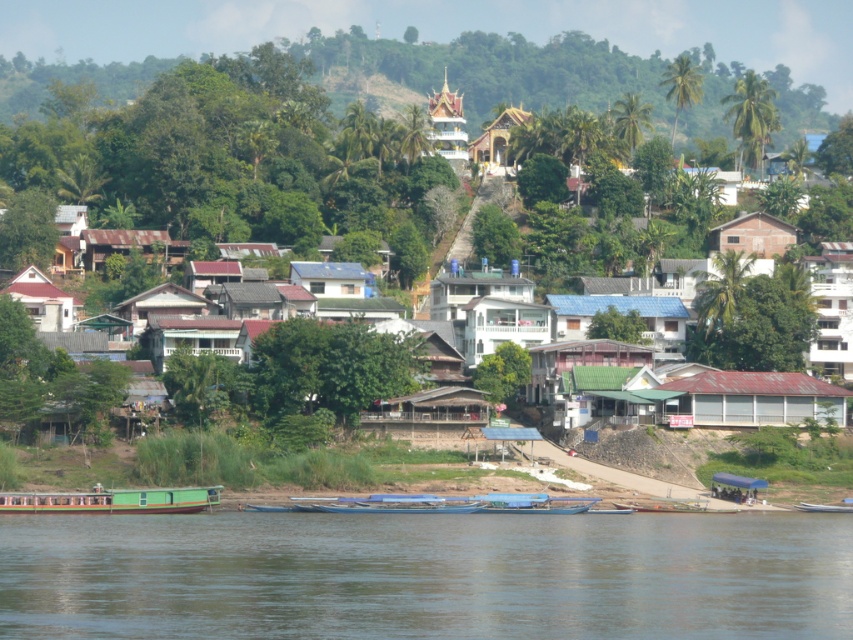
Question: Does rusty metal hut at lower right lie in front of blue corrugated metal hut at center?

Choices:
 (A) yes
 (B) no

Answer: (A)

Question: Is green matte boat at lower left above white matte house at lower left?

Choices:
 (A) no
 (B) yes

Answer: (A)

Question: Which of these objects is positioned closest to the blue corrugated metal hut at center?

Choices:
 (A) white matte house at center
 (B) white matte house at lower left

Answer: (A)

Question: Which point is farther from the camera taking this photo?

Choices:
 (A) (334, 157)
 (B) (723, 240)
 (C) (102, 490)
 (D) (706, 396)

Answer: (A)

Question: Which object is positioned closest to the white matte house at center?

Choices:
 (A) matte wooden temple at upper center
 (B) green matte boat at lower left
 (C) white matte building at center

Answer: (C)

Question: Is blue corrugated metal hut at center thinner than blue plastic boat at center?

Choices:
 (A) no
 (B) yes

Answer: (A)